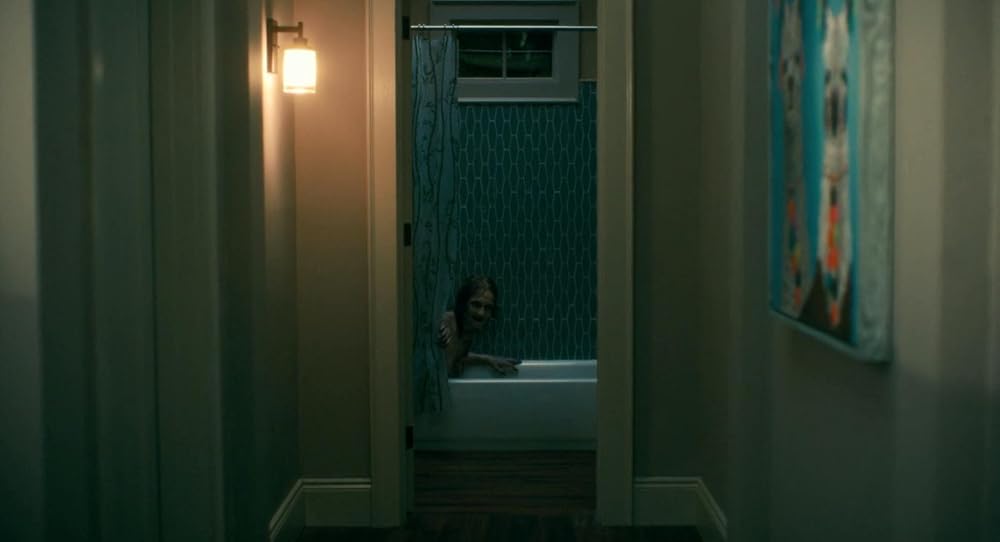
The image size is (1000, 542). Identify the location of shower curtain. (558, 482), (557, 27).